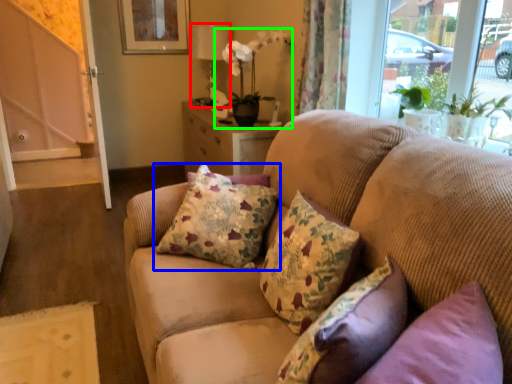
Question: Which is farther away from lamp (highlighted by a red box)? pillow (highlighted by a blue box) or houseplant (highlighted by a green box)?

Choices:
 (A) pillow
 (B) houseplant

Answer: (A)